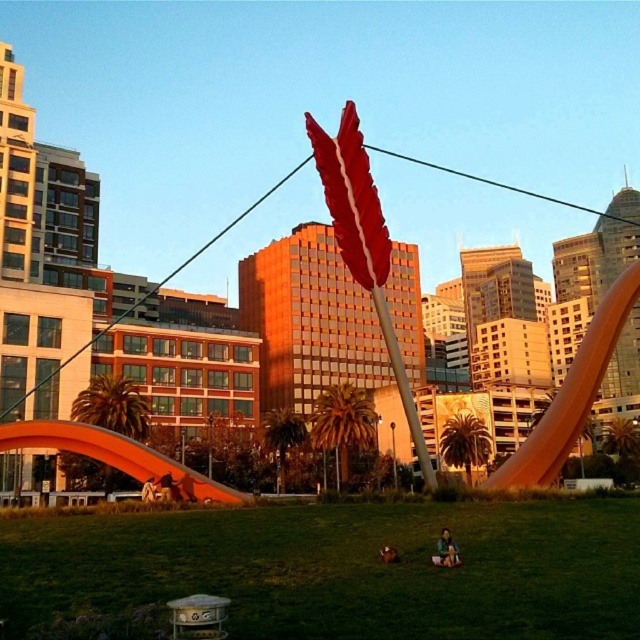
Can you confirm if green fabric person at lower center is thinner than brown leather jacket at lower center?

No.

Who is positioned more to the left, green fabric person at lower center or brown leather jacket at lower center?

Positioned to the left is brown leather jacket at lower center.

Which is in front, point (452, 548) or point (397, 556)?

Point (452, 548)

Identify the location of green fabric person at lower center. (445, 550).

Is green grass at center smaller than green fabric person at lower center?

Actually, green grass at center might be larger than green fabric person at lower center.

Which is above, green grass at center or green fabric person at lower center?

green fabric person at lower center

What are the coordinates of `green grass at center` in the screenshot? It's located at (342, 568).

The image size is (640, 640). In order to click on green grass at center in this screenshot , I will do `click(342, 568)`.

Which is in front, point (584, 544) or point (384, 547)?

Positioned in front is point (384, 547).

Does green grass at center appear on the left side of brown leather jacket at lower center?

In fact, green grass at center is to the right of brown leather jacket at lower center.

Who is more distant from viewer, (314,634) or (381,545)?

Positioned behind is point (381,545).

Locate an element on the screen. The width and height of the screenshot is (640, 640). green grass at center is located at coordinates coord(342,568).